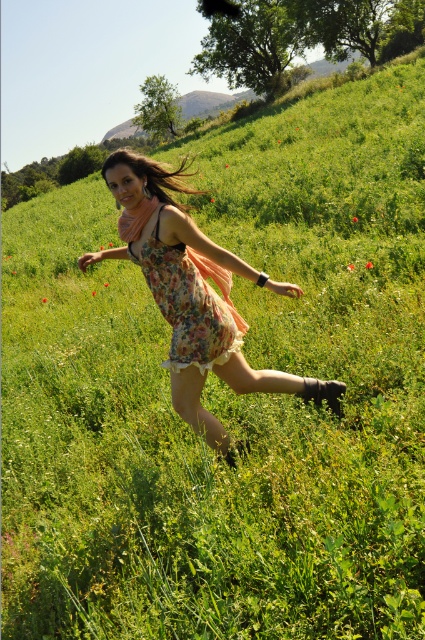
In the scene, there are two descriptions of the woman wearing a dress at the center. One is labeled as the floral dress at center and the other as the floral fabric dress at center. Which one is bigger in size?

The floral dress at center is larger in size than the floral fabric dress at center.

You are a fashion designer observing the woman in the image. You need to determine which item of clothing is wider between the floral dress at center and the floral fabric dress at center. Which one is wider?

The floral dress at center is wider than the floral fabric dress at center according to the description provided.